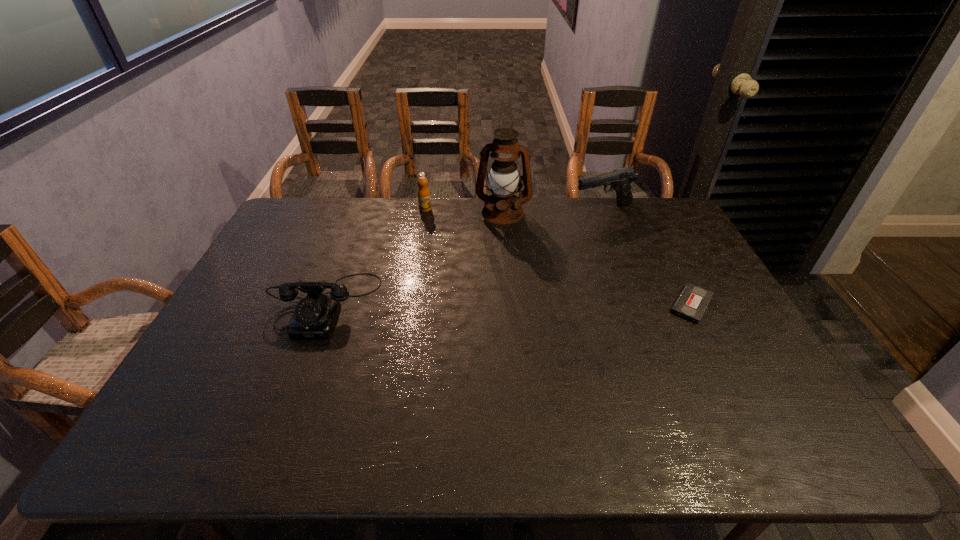
Where is `blank area located on the side of the lantern, there is a wick adjustment knob`? This screenshot has height=540, width=960. blank area located on the side of the lantern, there is a wick adjustment knob is located at coordinates (494, 248).

You are a GUI agent. You are given a task and a screenshot of the screen. Output one action in this format:
    pyautogui.click(x=<x>, y=<y>)
    Task: Click on the vacant space situated on the side of the lantern, there is a wick adjustment knob
    The width and height of the screenshot is (960, 540).
    Given the screenshot: What is the action you would take?
    pyautogui.click(x=483, y=303)

You are a GUI agent. You are given a task and a screenshot of the screen. Output one action in this format:
    pyautogui.click(x=<x>, y=<y>)
    Task: Click on the free region located on the front label of the orange juice
    
    Given the screenshot: What is the action you would take?
    pyautogui.click(x=465, y=279)

The height and width of the screenshot is (540, 960). In order to click on blank area located on the front label of the orange juice in this screenshot , I will do `click(438, 231)`.

At what (x,y) coordinates should I click in order to perform the action: click on vacant space located 0.070m on the front label of the orange juice. Please return your answer as a coordinate pair (x, y). The height and width of the screenshot is (540, 960). Looking at the image, I should click on (433, 222).

Locate an element on the screen. Image resolution: width=960 pixels, height=540 pixels. free space located at the muzzle of the gun is located at coordinates (565, 256).

The width and height of the screenshot is (960, 540). In order to click on vacant region located at the muzzle of the gun in this screenshot , I will do `click(570, 248)`.

You are a GUI agent. You are given a task and a screenshot of the screen. Output one action in this format:
    pyautogui.click(x=<x>, y=<y>)
    Task: Click on the vacant space situated 0.080m at the muzzle of the gun
    The image size is (960, 540).
    Given the screenshot: What is the action you would take?
    pyautogui.click(x=583, y=230)

This screenshot has height=540, width=960. In order to click on lantern at the far edge in this screenshot , I will do `click(502, 207)`.

Image resolution: width=960 pixels, height=540 pixels. I want to click on orange juice at the far edge, so click(424, 201).